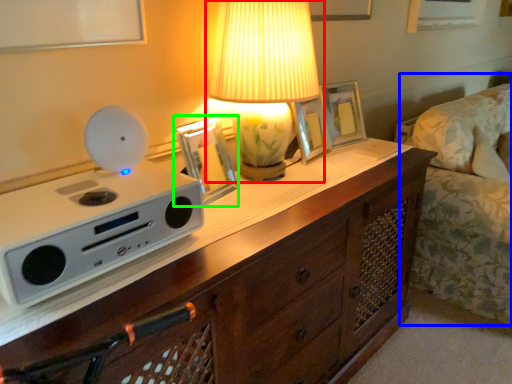
Question: Considering the real-world distances, which object is farthest from lamp (highlighted by a red box)? couch (highlighted by a blue box) or picture frame (highlighted by a green box)?

Choices:
 (A) couch
 (B) picture frame

Answer: (A)